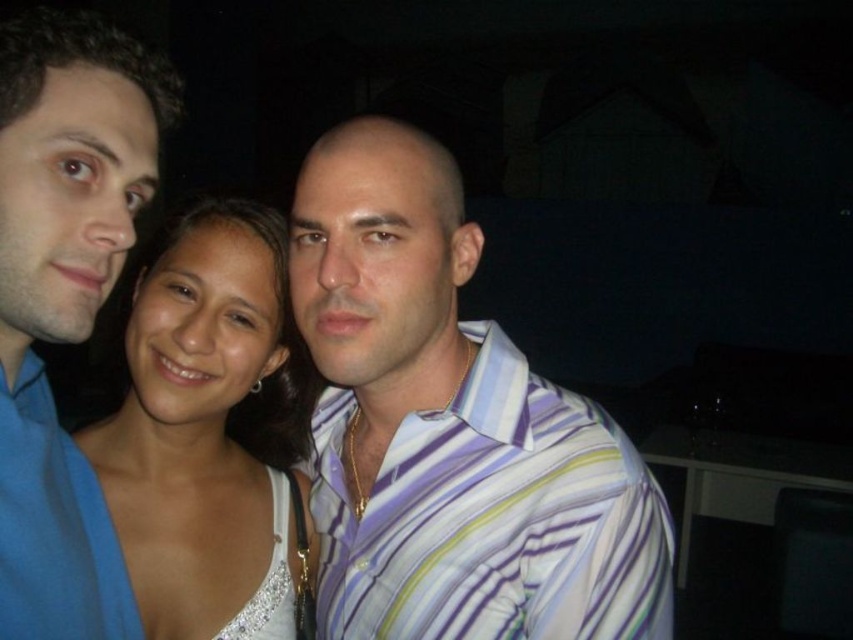
You are a photographer trying to adjust the lighting for a group photo. You notice two items in the center of the image, a striped cotton shirt and a white sequined dress. Since the distance between them is critical for proper lighting, can you determine if the distance between the striped cotton shirt at center and the white sequined dress at center is less than 10 inches?

The striped cotton shirt at center and white sequined dress at center are 9.34 inches apart, so yes, the distance between them is less than 10 inches.

Looking at this image, you are a photographer at an indoor event and need to adjust the lighting for a group photo. The subjects are wearing a striped cotton shirt at center and a blue smooth shirt at left. Which shirt might require more light to capture details due to its material? Please explain your reasoning based on their positions and sizes.

The striped cotton shirt at center is larger in size than the blue smooth shirt at left. Since cotton is a porous material that can absorb light, it might require more light to ensure details like the stripes are visible. The blue smooth shirt at left, made of a reflective material, could reflect available light better, making it easier to capture details without additional lighting.